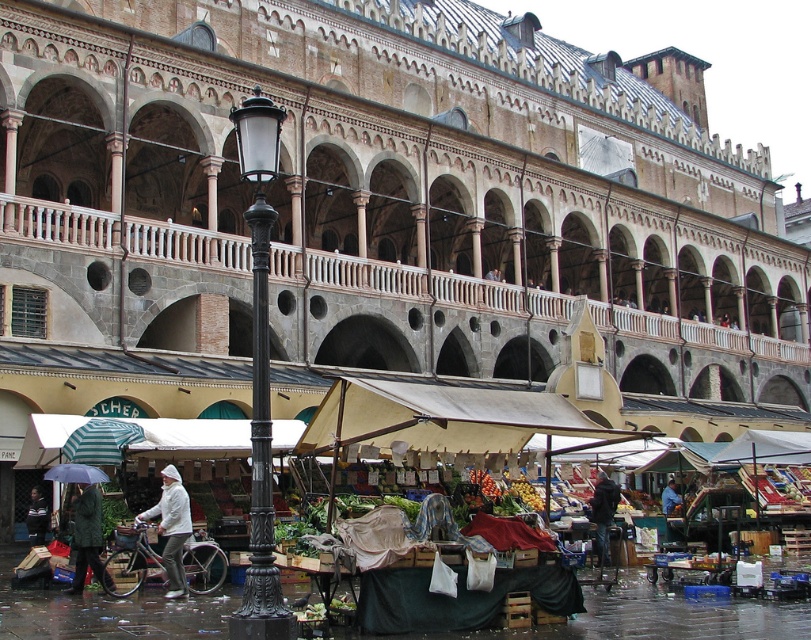
Question: Is striped fabric umbrella at lower left bigger than dark gray sweater at lower left?

Choices:
 (A) yes
 (B) no

Answer: (A)

Question: Which point appears farthest from the camera in this image?

Choices:
 (A) (614, 508)
 (B) (92, 481)
 (C) (165, 593)

Answer: (A)

Question: Is white matte jacket at center above dark gray sweater at lower left?

Choices:
 (A) yes
 (B) no

Answer: (A)

Question: Based on their relative distances, which object is nearer to the dark gray sweater at lower left?

Choices:
 (A) dark blue jacket at lower center
 (B) white matte jacket at center
 (C) transparent nylon umbrella at lower left
 (D) light brown leather jacket at center

Answer: (C)

Question: Which point is farther to the camera?

Choices:
 (A) transparent nylon umbrella at lower left
 (B) dark gray sweater at lower left
 (C) camouflage jacket at lower left
 (D) black cast iron streetlight at center

Answer: (B)

Question: Is white matte jacket at center wider than striped fabric umbrella at lower left?

Choices:
 (A) yes
 (B) no

Answer: (B)